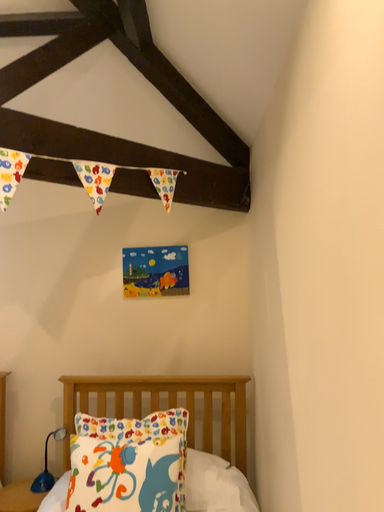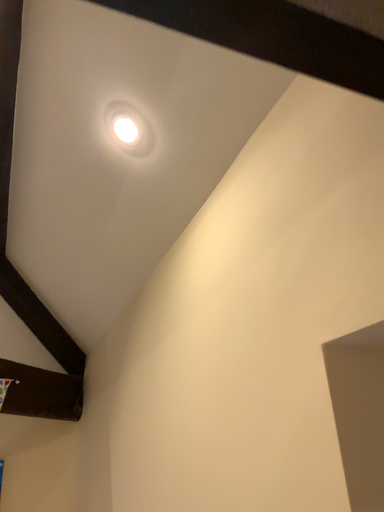
Question: How did the camera likely rotate when shooting the video?

Choices:
 (A) rotated left
 (B) rotated right

Answer: (B)